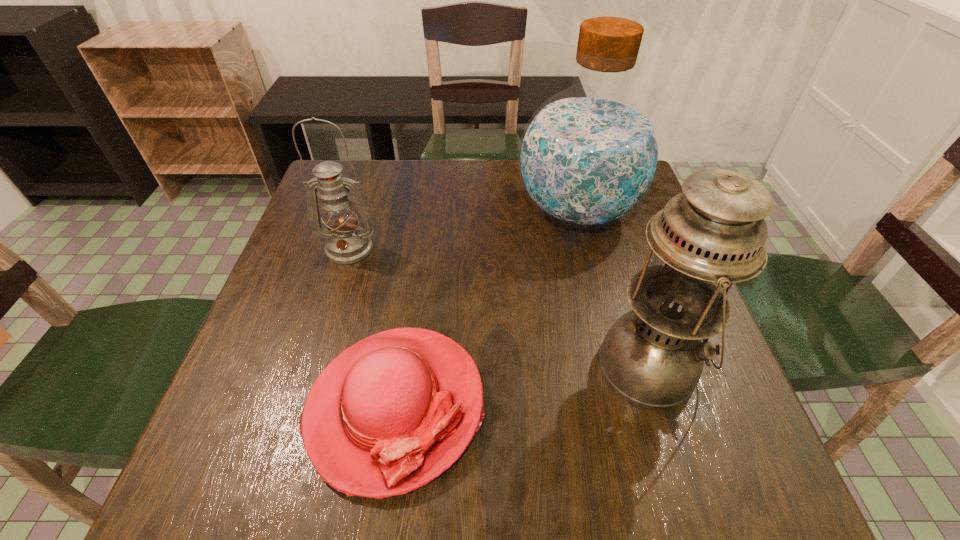
Identify the location of object present at the near edge. The image size is (960, 540). (389, 414).

The height and width of the screenshot is (540, 960). I want to click on oil lamp that is at the left edge, so click(346, 243).

The width and height of the screenshot is (960, 540). In order to click on hat at the left edge in this screenshot , I will do `click(389, 414)`.

This screenshot has width=960, height=540. What are the coordinates of `water jug positioned at the right edge` in the screenshot? It's located at (589, 155).

Locate an element on the screen. oil lamp at the right edge is located at coordinates (712, 235).

The image size is (960, 540). Identify the location of object located in the near left corner section of the desktop. (389, 414).

The image size is (960, 540). I want to click on object that is at the far right corner, so click(589, 155).

In the image, there is a desktop. At what (x,y) coordinates should I click in order to perform the action: click on free region at the far edge. Please return your answer as a coordinate pair (x, y). Image resolution: width=960 pixels, height=540 pixels. Looking at the image, I should click on (403, 199).

Find the location of a particular element. The height and width of the screenshot is (540, 960). vacant area at the near edge is located at coordinates (554, 488).

You are a GUI agent. You are given a task and a screenshot of the screen. Output one action in this format:
    pyautogui.click(x=<x>, y=<y>)
    Task: Click on the blank space at the left edge of the desktop
    The width and height of the screenshot is (960, 540).
    Given the screenshot: What is the action you would take?
    pyautogui.click(x=346, y=269)